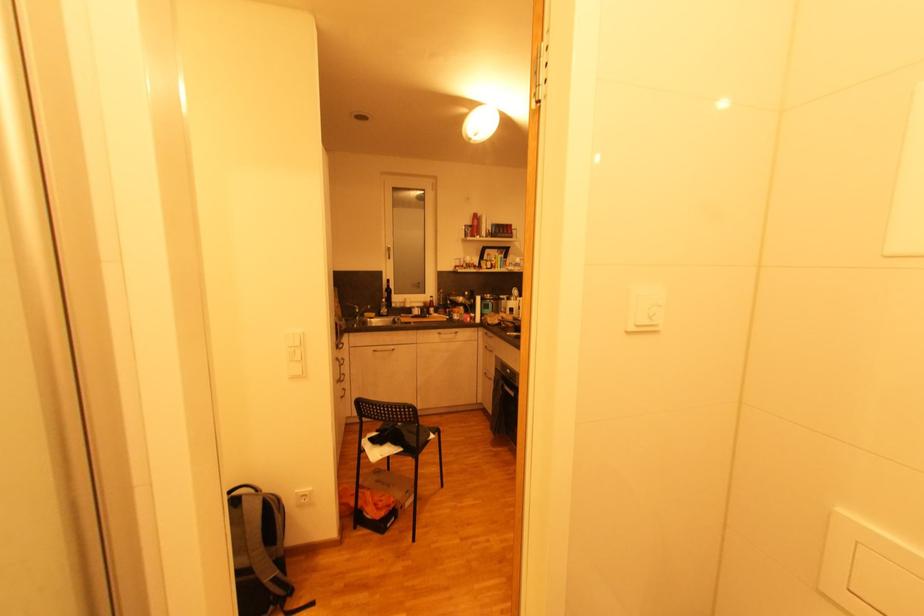
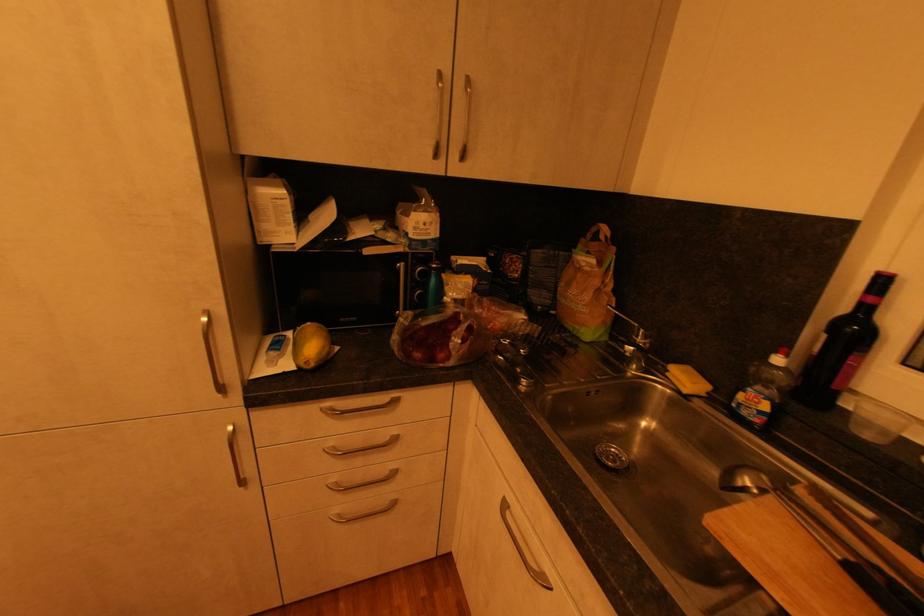
Where in the second image is the point corresponding to [380,352] from the first image?

(508, 507)